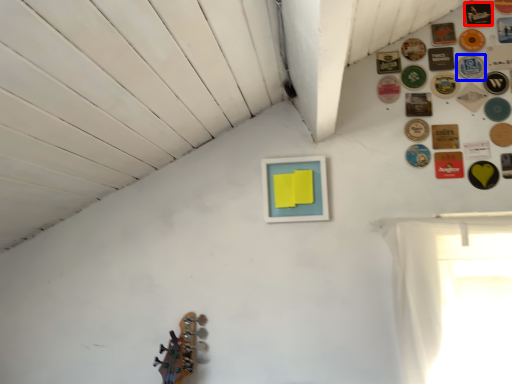
Question: Among these objects, which one is farthest to the camera, button (highlighted by a red box) or button (highlighted by a blue box)?

Choices:
 (A) button
 (B) button

Answer: (A)